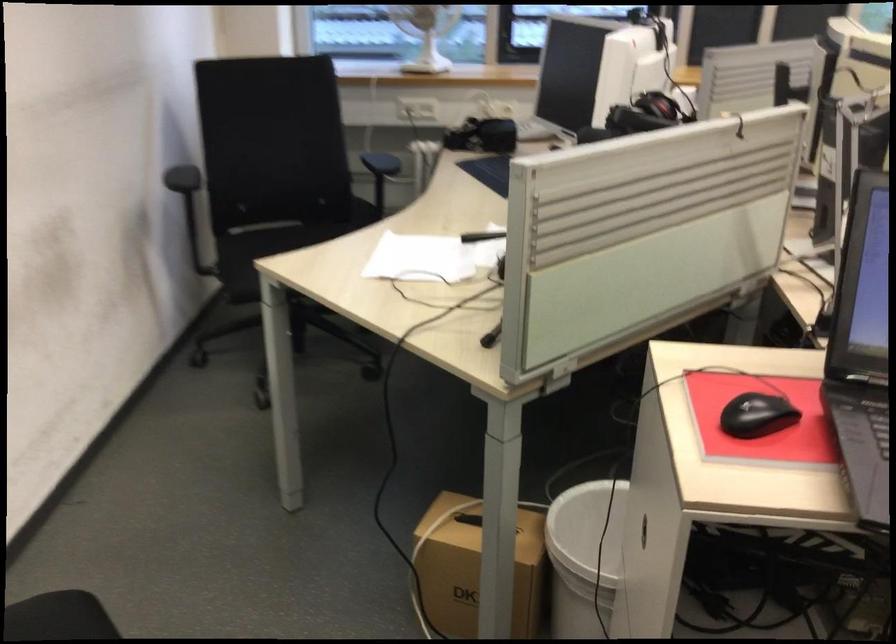
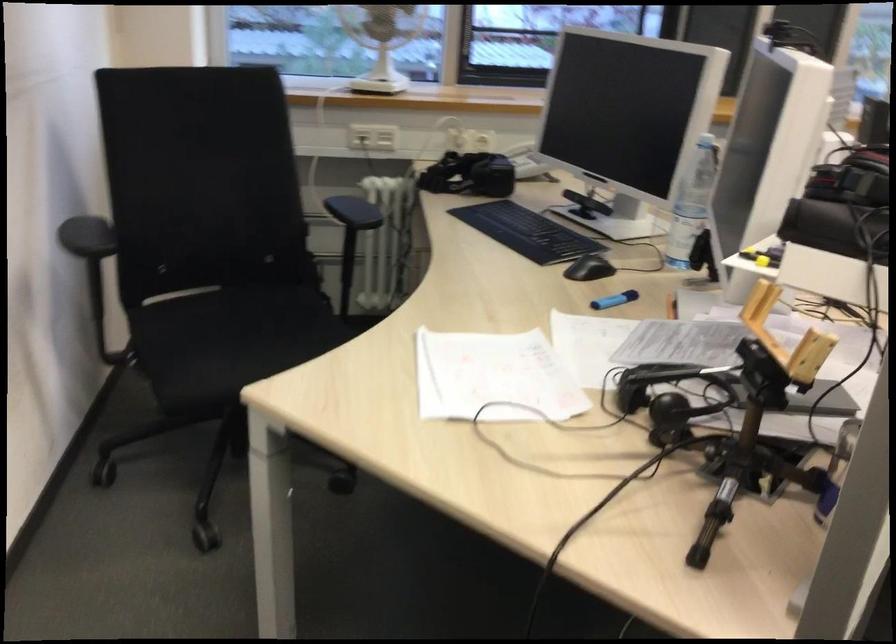
In the second image, find the point that corresponds to the point at 403,109 in the first image.

(358, 138)